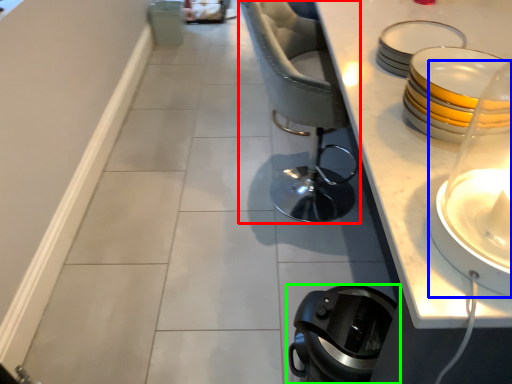
Question: Which object is the closest to the chair (highlighted by a red box)? Choose among these: candle holder (highlighted by a blue box) or home appliance (highlighted by a green box).

Choices:
 (A) candle holder
 (B) home appliance

Answer: (B)